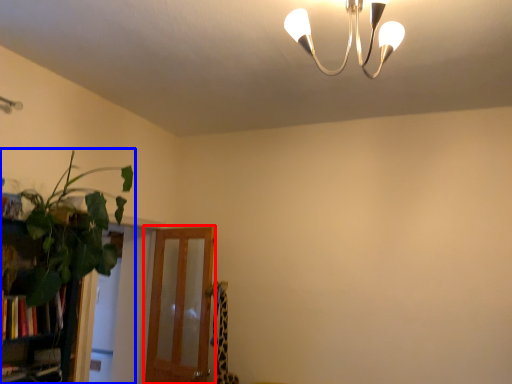
Question: Which object appears farthest to the camera in this image, screen door (highlighted by a red box) or houseplant (highlighted by a blue box)?

Choices:
 (A) screen door
 (B) houseplant

Answer: (A)